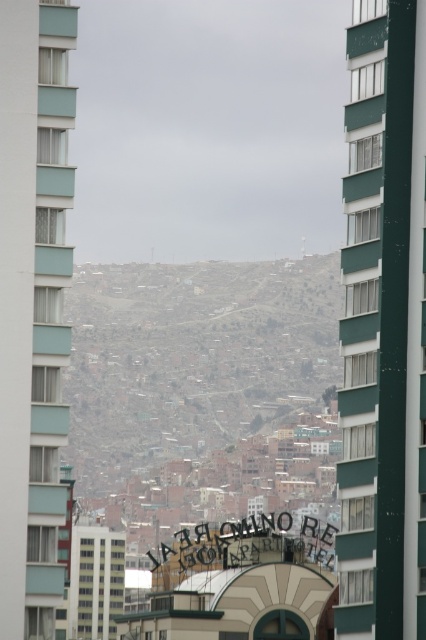
Which is in front, point (92, 301) or point (83, 557)?

Positioned in front is point (83, 557).

The width and height of the screenshot is (426, 640). What are the coordinates of `brown textured buildings at center` in the screenshot? It's located at (192, 358).

Consider the image. Who is more distant from viewer, (419,435) or (29,570)?

Point (419,435)

Who is more distant from viewer, (412, 528) or (11, 404)?

The point (11, 404) is behind.

The width and height of the screenshot is (426, 640). Identify the location of green glass building at right. (383, 326).

Who is positioned more to the left, green glass building at right or white concrete building at center?

From the viewer's perspective, white concrete building at center appears more on the left side.

Is green glass building at right shorter than white concrete building at center?

No, green glass building at right is not shorter than white concrete building at center.

Describe the element at coordinates (383, 326) in the screenshot. I see `green glass building at right` at that location.

Find the location of a particular element. The height and width of the screenshot is (640, 426). green glass building at right is located at coordinates pos(383,326).